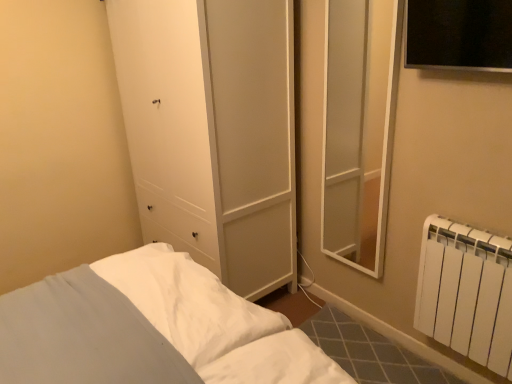
Measure the distance between white matte radiator at lower right and camera.

white matte radiator at lower right and camera are 1.58 meters apart.

Measure the distance between point (450, 230) and camera.

The distance of point (450, 230) from camera is 5.85 feet.

This screenshot has width=512, height=384. What do you see at coordinates (466, 292) in the screenshot?
I see `white matte radiator at lower right` at bounding box center [466, 292].

This screenshot has height=384, width=512. Identify the location of white matte radiator at lower right. (466, 292).

The width and height of the screenshot is (512, 384). What do you see at coordinates (82, 335) in the screenshot? I see `white soft pillow at lower left` at bounding box center [82, 335].

Based on the photo, measure the distance between point (15, 366) and camera.

1.20 meters.

I want to click on white soft pillow at lower left, so click(x=82, y=335).

Locate an element on the screen. white matte radiator at lower right is located at coordinates (466, 292).

Based on the photo, is white soft pillow at lower left to the right of white matte radiator at lower right from the viewer's perspective?

Incorrect, white soft pillow at lower left is not on the right side of white matte radiator at lower right.

Which object is further away from the camera taking this photo, white soft pillow at lower left or white matte radiator at lower right?

white matte radiator at lower right is more distant.

Considering the points (150, 336) and (476, 286), which point is behind, point (150, 336) or point (476, 286)?

Positioned behind is point (476, 286).

From the image's perspective, would you say white soft pillow at lower left is positioned over white matte radiator at lower right?

Actually, white soft pillow at lower left appears below white matte radiator at lower right in the image.

From a real-world perspective, is white soft pillow at lower left positioned over white matte radiator at lower right based on gravity?

Actually, white soft pillow at lower left is physically below white matte radiator at lower right in the real world.

Is white soft pillow at lower left thinner than white matte radiator at lower right?

No.

In the scene shown: Considering the sizes of white soft pillow at lower left and white matte radiator at lower right in the image, is white soft pillow at lower left taller or shorter than white matte radiator at lower right?

white soft pillow at lower left is taller than white matte radiator at lower right.

Does white soft pillow at lower left have a larger size compared to white matte radiator at lower right?

Indeed, white soft pillow at lower left has a larger size compared to white matte radiator at lower right.

Is white matte radiator at lower right located within white soft pillow at lower left?

No.

Are white soft pillow at lower left and white matte radiator at lower right far apart?

Yes.

Is white soft pillow at lower left facing away from white matte radiator at lower right?

No.

Identify the location of radiator on the right side of white soft pillow at lower left. (466, 292).

Which is more to the right, white matte radiator at lower right or white soft pillow at lower left?

Positioned to the right is white matte radiator at lower right.

Which object is further away from the camera, white matte radiator at lower right or white soft pillow at lower left?

Positioned behind is white matte radiator at lower right.

Is point (453, 231) farther from viewer compared to point (139, 333)?

Yes, it is behind point (139, 333).

From the image's perspective, which is above, white matte radiator at lower right or white soft pillow at lower left?

white matte radiator at lower right appears higher in the image.

From a real-world perspective, is white matte radiator at lower right located higher than white soft pillow at lower left?

Indeed, from a real-world perspective, white matte radiator at lower right stands above white soft pillow at lower left.

Looking at their sizes, would you say white matte radiator at lower right is wider or thinner than white soft pillow at lower left?

In the image, white matte radiator at lower right appears to be more narrow than white soft pillow at lower left.

Between white matte radiator at lower right and white soft pillow at lower left, which one has more height?

Standing taller between the two is white soft pillow at lower left.

Can you confirm if white matte radiator at lower right is bigger than white soft pillow at lower left?

Incorrect, white matte radiator at lower right is not larger than white soft pillow at lower left.

Is white soft pillow at lower left surrounded by white matte radiator at lower right?

No, white soft pillow at lower left is not a part of white matte radiator at lower right.

Is white matte radiator at lower right directly adjacent to white soft pillow at lower left?

No, white matte radiator at lower right is not making contact with white soft pillow at lower left.

Could you tell me if white matte radiator at lower right is facing white soft pillow at lower left?

Yes.

What's the angular difference between white matte radiator at lower right and white soft pillow at lower left's facing directions?

There is a 178-degree angle between the facing directions of white matte radiator at lower right and white soft pillow at lower left.

Image resolution: width=512 pixels, height=384 pixels. What are the coordinates of `radiator on the right of white soft pillow at lower left` in the screenshot? It's located at (466, 292).

This screenshot has width=512, height=384. I want to click on radiator that appears on the right of white soft pillow at lower left, so click(466, 292).

Identify the location of pillow located below the white matte radiator at lower right (from the image's perspective). The height and width of the screenshot is (384, 512). (82, 335).